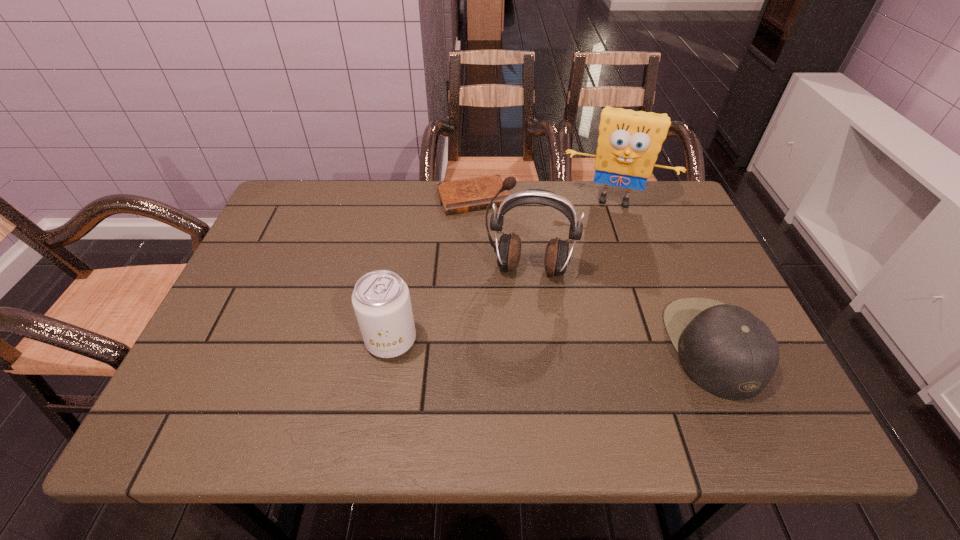
Find the location of a particular element. The width and height of the screenshot is (960, 540). the second closest object to the diary is located at coordinates coord(557,256).

Locate which object is the second closest to the sponge. Please provide its 2D coordinates. Your answer should be formatted as a tuple, i.e. [(x, y)], where the tuple contains the x and y coordinates of a point satisfying the conditions above.

[(557, 256)]

Find the location of a particular element. The width and height of the screenshot is (960, 540). vacant space that satisfies the following two spatial constraints: 1. on the back side of the third farthest object; 2. on the left side of the sponge is located at coordinates (521, 199).

Locate an element on the screen. The height and width of the screenshot is (540, 960). vacant area in the image that satisfies the following two spatial constraints: 1. on the back side of the shortest object; 2. on the left side of the leftmost object is located at coordinates (416, 197).

Image resolution: width=960 pixels, height=540 pixels. In order to click on vacant space that satisfies the following two spatial constraints: 1. on the front side of the shortest object; 2. on the right side of the earphone in this screenshot , I will do `click(472, 268)`.